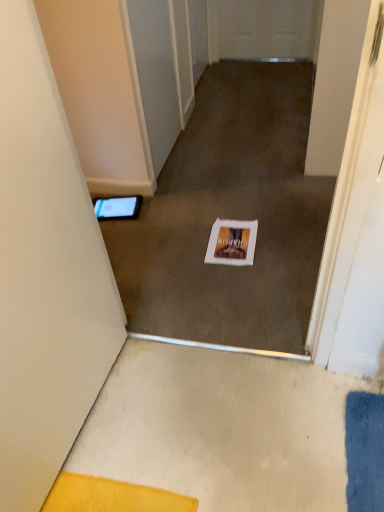
This screenshot has width=384, height=512. Identify the location of vacant space situated above white paper at center (from a real-world perspective). (228, 240).